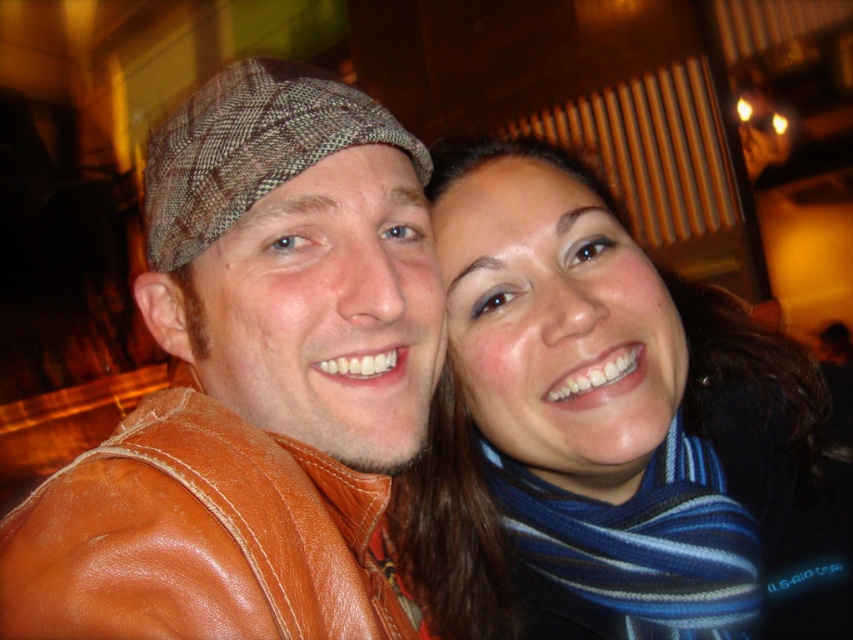
Question: Does brown leather jacket at left appear on the left side of blue striped scarf at lower right?

Choices:
 (A) no
 (B) yes

Answer: (B)

Question: From the image, what is the correct spatial relationship of striped scarf at center in relation to brown plaid hat at upper left?

Choices:
 (A) left
 (B) right

Answer: (B)

Question: Can you confirm if striped scarf at center is positioned above brown plaid hat at upper left?

Choices:
 (A) yes
 (B) no

Answer: (B)

Question: Which object appears closest to the camera in this image?

Choices:
 (A) brown leather jacket at left
 (B) striped scarf at center
 (C) brown plaid hat at upper left

Answer: (A)

Question: Which of the following is the farthest from the observer?

Choices:
 (A) (680, 480)
 (B) (256, 198)
 (C) (328, 336)
 (D) (433, 582)

Answer: (D)

Question: Which object appears farthest from the camera in this image?

Choices:
 (A) striped scarf at center
 (B) brown leather jacket at left
 (C) blue striped scarf at lower right
 (D) brown plaid hat at upper left

Answer: (C)